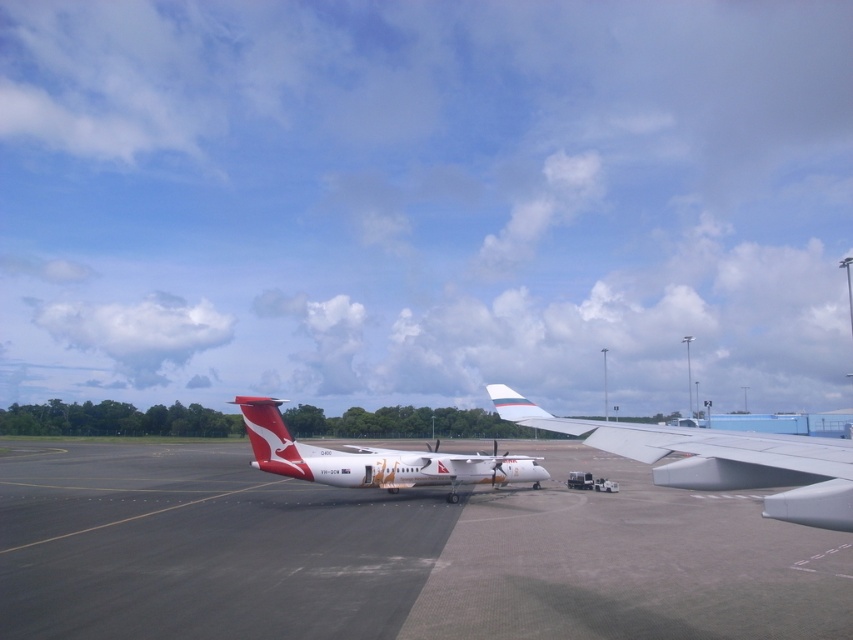
Can you confirm if smooth asphalt tarmac at center is taller than white glossy airplane at center?

No, smooth asphalt tarmac at center is not taller than white glossy airplane at center.

Which is in front, point (3, 593) or point (306, 474)?

Point (3, 593) is in front.

Where is `smooth asphalt tarmac at center`? This screenshot has width=853, height=640. smooth asphalt tarmac at center is located at coordinates (392, 556).

Who is positioned more to the left, white glossy wing at center or polished red tail at center?

polished red tail at center is more to the left.

Does point (706, 476) come behind point (293, 461)?

No, it is not.

The width and height of the screenshot is (853, 640). Find the location of `white glossy wing at center`. white glossy wing at center is located at coordinates (718, 460).

Who is higher up, smooth asphalt tarmac at center or polished red tail at center?

polished red tail at center

Looking at this image, is smooth asphalt tarmac at center in front of polished red tail at center?

Yes, smooth asphalt tarmac at center is closer to the viewer.

Where is `smooth asphalt tarmac at center`? This screenshot has width=853, height=640. smooth asphalt tarmac at center is located at coordinates (392, 556).

Where is `smooth asphalt tarmac at center`? The image size is (853, 640). smooth asphalt tarmac at center is located at coordinates (392, 556).